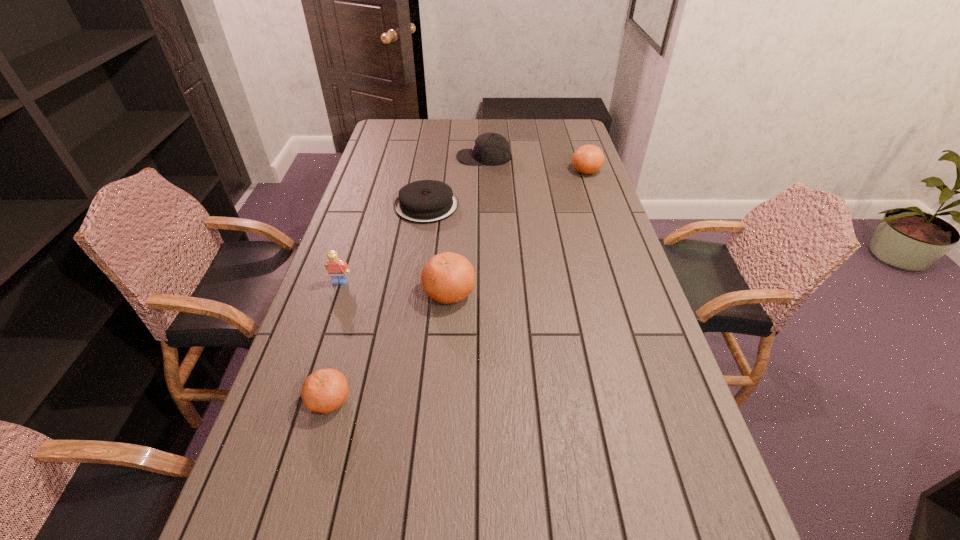
This screenshot has width=960, height=540. What are the coordinates of `spot to insert another clementine for uniform distribution` in the screenshot? It's located at click(x=529, y=222).